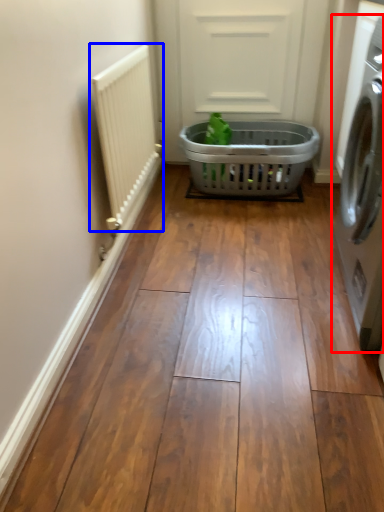
Question: Among these objects, which one is farthest to the camera, washing machine (highlighted by a red box) or radiator (highlighted by a blue box)?

Choices:
 (A) washing machine
 (B) radiator

Answer: (B)